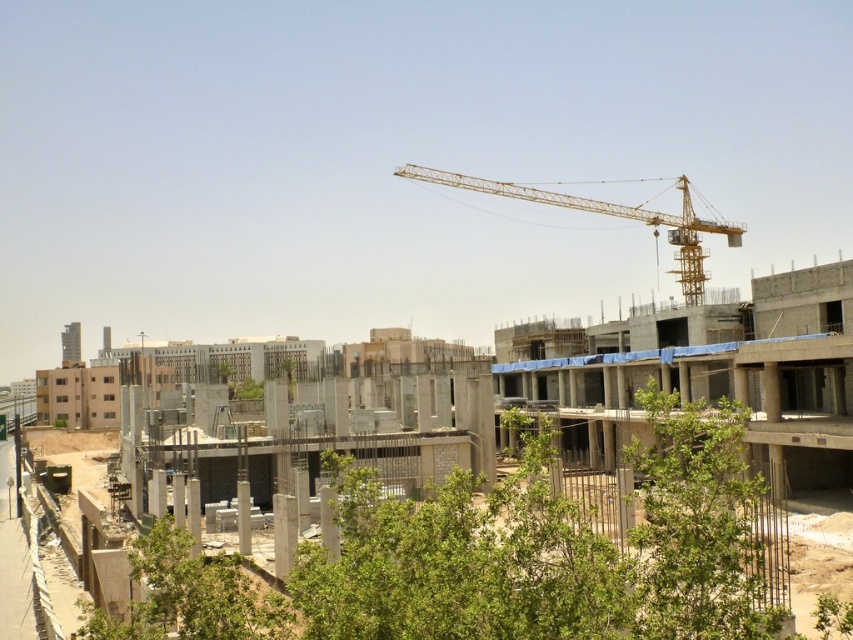
You are an engineer overseeing the construction site. You need to determine if the concrete at center can be safely reinforced by the yellow metallic crane at upper center. Considering their heights, is this feasible?

The concrete at center is taller than the yellow metallic crane at upper center, so the crane may not be tall enough to safely reinforce the concrete at center due to height limitations.

In the scene shown: You are a surveyor at the construction site and need to determine the spatial relationship between two points marked on your map. The first point is labeled as point (639,433) and the second is point (418,179). Based on the image provided, which point is closer to the observer?

Point (639,433) is in front of point (418,179), so it is closer to the observer.

You are a construction worker who needs to move a heavy material from the concrete at center to the yellow metallic crane at upper center. Which direction should you move the material to reach the crane?

The concrete at center is positioned on the left side of the yellow metallic crane at upper center, so you should move the material to the right to reach the crane.